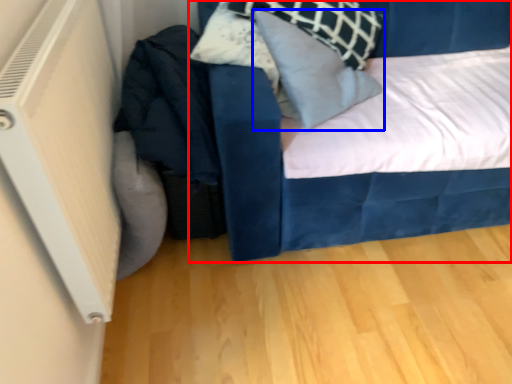
Question: Among these objects, which one is nearest to the camera, bed (highlighted by a red box) or pillow (highlighted by a blue box)?

Choices:
 (A) bed
 (B) pillow

Answer: (A)